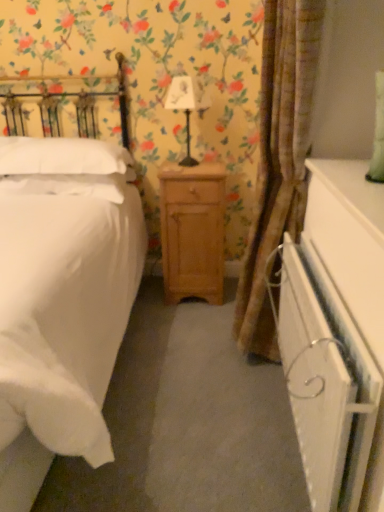
Question: From a real-world perspective, is white glossy dresser at lower right physically above light brown wood nightstand at center?

Choices:
 (A) no
 (B) yes

Answer: (B)

Question: Is the surface of white glossy dresser at lower right in direct contact with light brown wood nightstand at center?

Choices:
 (A) no
 (B) yes

Answer: (A)

Question: Is white glossy dresser at lower right positioned with its back to light brown wood nightstand at center?

Choices:
 (A) yes
 (B) no

Answer: (B)

Question: Is white glossy dresser at lower right located outside light brown wood nightstand at center?

Choices:
 (A) no
 (B) yes

Answer: (B)

Question: Considering the relative sizes of white glossy dresser at lower right and light brown wood nightstand at center in the image provided, is white glossy dresser at lower right wider than light brown wood nightstand at center?

Choices:
 (A) yes
 (B) no

Answer: (B)

Question: From the image's perspective, relative to white soft pillow at left, positioned as the 2th pillow in top-to-bottom order, is brown textured curtain at center above or below?

Choices:
 (A) below
 (B) above

Answer: (A)

Question: Considering the positions of brown textured curtain at center and white soft pillow at left, positioned as the 2th pillow in top-to-bottom order, in the image, is brown textured curtain at center bigger or smaller than white soft pillow at left, positioned as the 2th pillow in top-to-bottom order,?

Choices:
 (A) small
 (B) big

Answer: (B)

Question: Considering the positions of brown textured curtain at center and white soft pillow at left, positioned as the 2th pillow in top-to-bottom order, in the image, is brown textured curtain at center wider or thinner than white soft pillow at left, positioned as the 2th pillow in top-to-bottom order,?

Choices:
 (A) thin
 (B) wide

Answer: (A)

Question: Considering the relative positions of brown textured curtain at center and white soft pillow at left, positioned as the 2th pillow in top-to-bottom order, in the image provided, is brown textured curtain at center to the left or to the right of white soft pillow at left, positioned as the 2th pillow in top-to-bottom order,?

Choices:
 (A) right
 (B) left

Answer: (A)

Question: From the image's perspective, is brown textured curtain at center above or below light brown wood nightstand at center?

Choices:
 (A) above
 (B) below

Answer: (A)

Question: From a real-world perspective, relative to light brown wood nightstand at center, is brown textured curtain at center vertically above or below?

Choices:
 (A) below
 (B) above

Answer: (B)

Question: Is point (256, 351) closer or farther from the camera than point (168, 226)?

Choices:
 (A) farther
 (B) closer

Answer: (B)

Question: Which is correct: brown textured curtain at center is inside light brown wood nightstand at center, or outside of it?

Choices:
 (A) outside
 (B) inside

Answer: (A)

Question: In the image, is white glossy dresser at lower right positioned in front of or behind light brown wood nightstand at center?

Choices:
 (A) front
 (B) behind

Answer: (A)

Question: Does point (349, 165) appear closer or farther from the camera than point (182, 223)?

Choices:
 (A) farther
 (B) closer

Answer: (B)